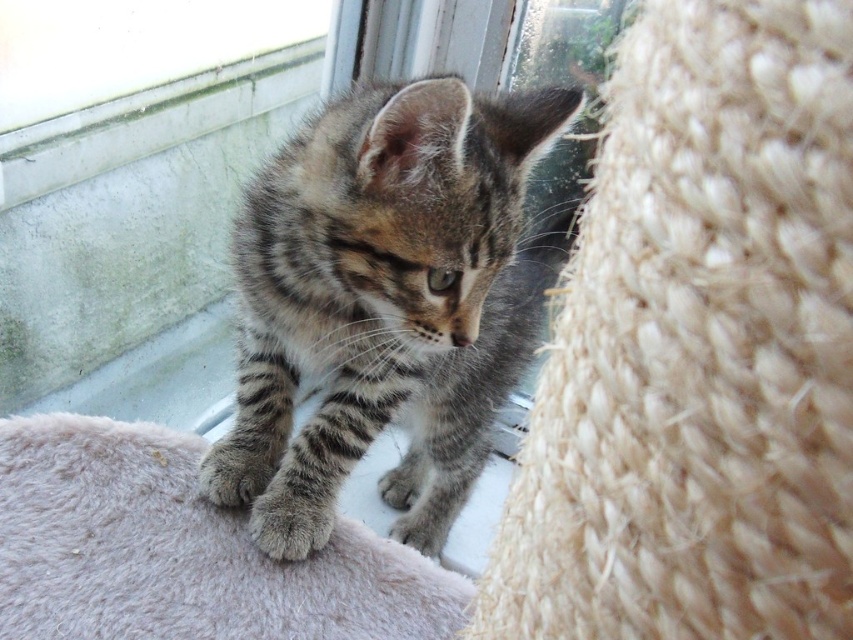
Can you confirm if striped fur kitten at center is shorter than soft fur paw at center?

No, striped fur kitten at center is not shorter than soft fur paw at center.

Which of these two, striped fur kitten at center or soft fur paw at center, stands shorter?

Standing shorter between the two is soft fur paw at center.

You are a GUI agent. You are given a task and a screenshot of the screen. Output one action in this format:
    pyautogui.click(x=<x>, y=<y>)
    Task: Click on the striped fur kitten at center
    
    Given the screenshot: What is the action you would take?
    pyautogui.click(x=395, y=284)

Is fuzzy gray blanket at lower left shorter than soft fur paw at center?

No.

Is fuzzy gray blanket at lower left positioned behind soft fur paw at center?

No, fuzzy gray blanket at lower left is closer to the viewer.

I want to click on fuzzy gray blanket at lower left, so click(x=181, y=552).

Between soft fur paw at center and soft gray fur paw at lower left, which one has less height?

With less height is soft fur paw at center.

Where is `soft fur paw at center`? The image size is (853, 640). soft fur paw at center is located at coordinates (291, 520).

The width and height of the screenshot is (853, 640). What do you see at coordinates (291, 520) in the screenshot?
I see `soft fur paw at center` at bounding box center [291, 520].

Where is `soft fur paw at center`? This screenshot has height=640, width=853. soft fur paw at center is located at coordinates (291, 520).